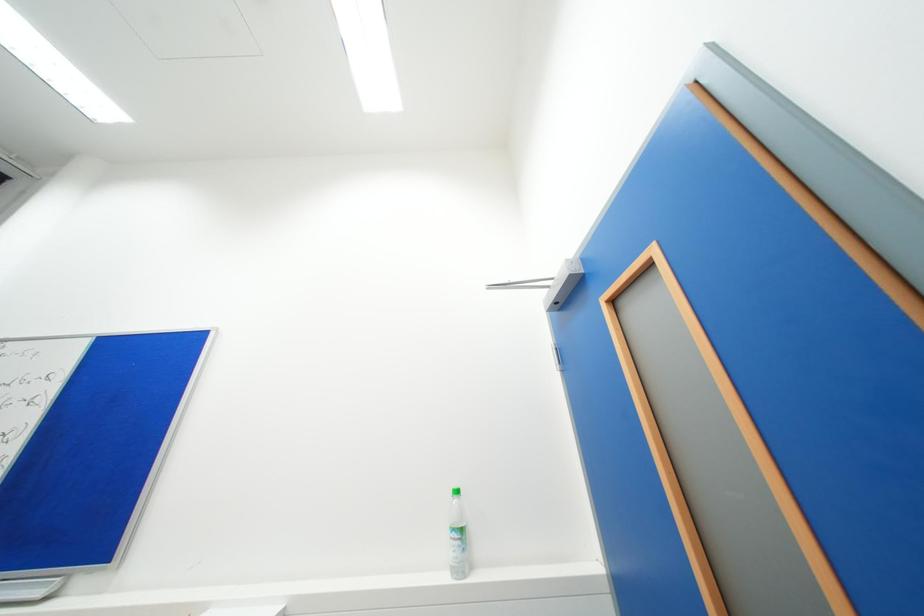
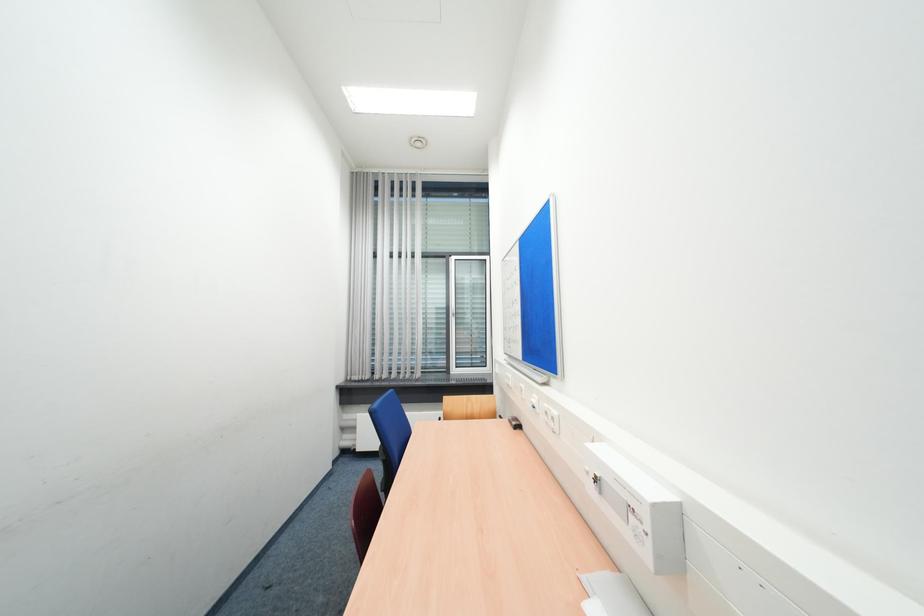
Question: The camera is either moving clockwise (left) or counter-clockwise (right) around the object. The first image is from the beginning of the video and the second image is from the end. Is the camera moving left or right when shooting the video?

Choices:
 (A) Left
 (B) Right

Answer: (B)